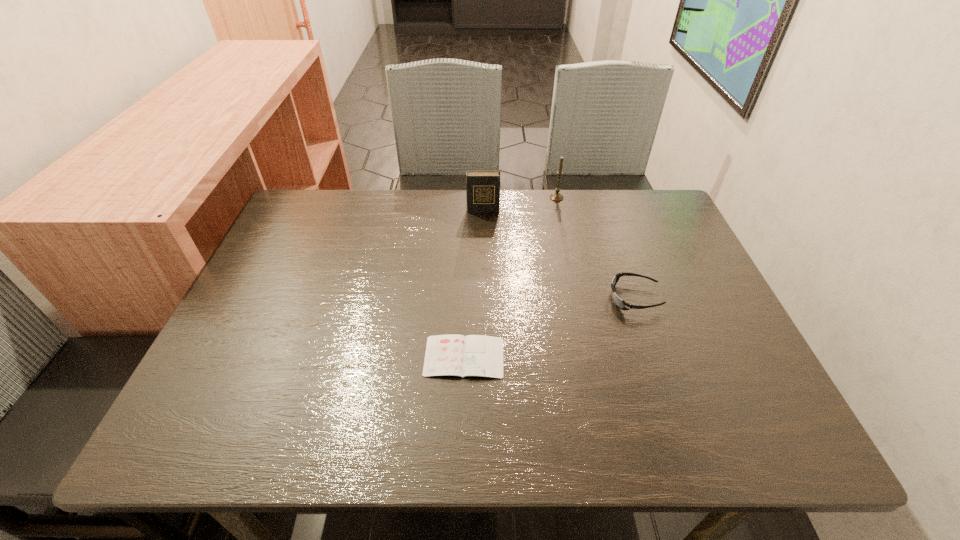
You are a GUI agent. You are given a task and a screenshot of the screen. Output one action in this format:
    pyautogui.click(x=<x>, y=<y>)
    Task: Click on the vacant region between the second nearest object and the shorter diary
    
    Given the screenshot: What is the action you would take?
    pyautogui.click(x=549, y=328)

Locate an element on the screen. This screenshot has height=540, width=960. vacant point located between the candle and the shorter diary is located at coordinates (511, 277).

Image resolution: width=960 pixels, height=540 pixels. I want to click on object that is the second closest one to the farther diary, so click(621, 304).

This screenshot has width=960, height=540. I want to click on object that is the closest to the shorter diary, so click(x=621, y=304).